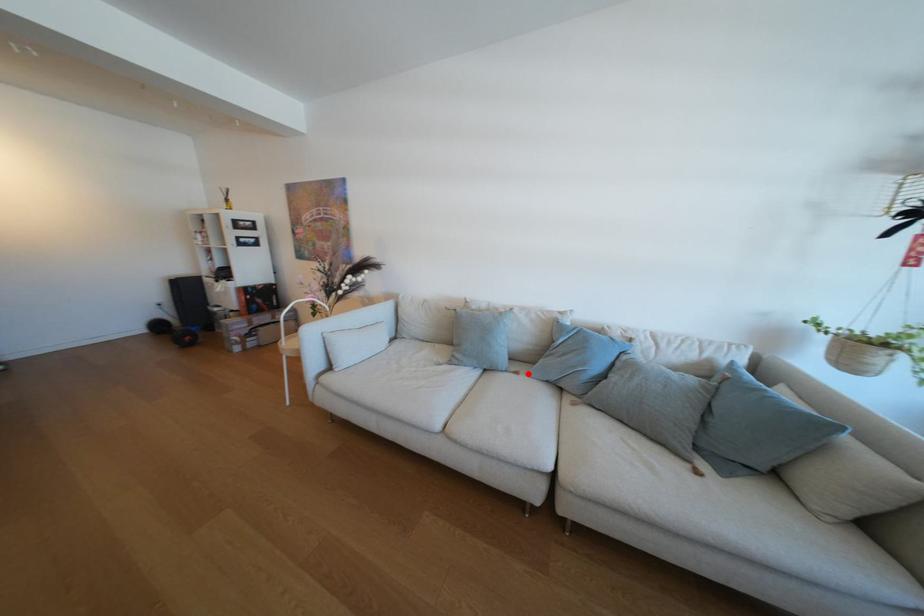
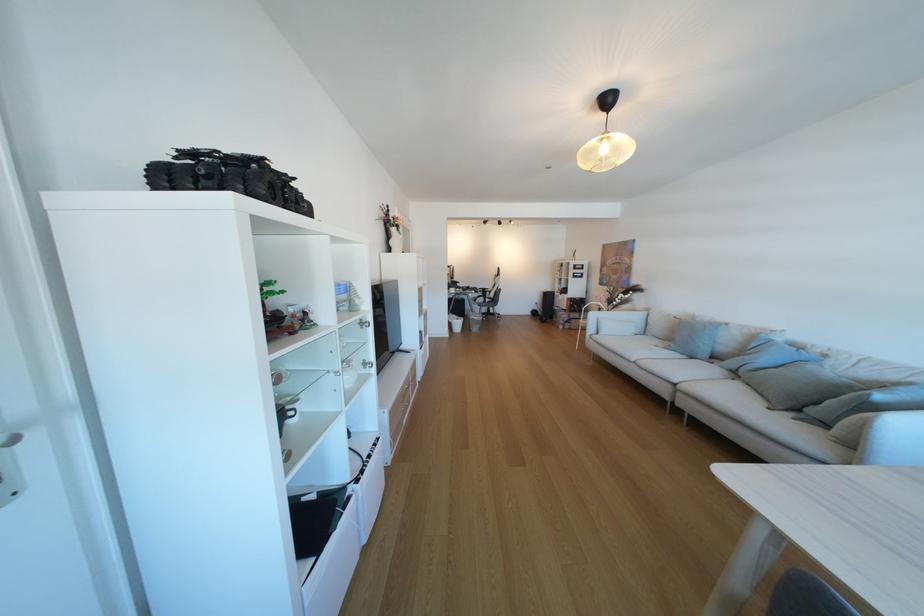
Question: I am providing you with two images of the same scene from different viewpoints. Given a red point in image1, look at the same physical point in image2. Is it:

Choices:
 (A) Closer to the viewpoint
 (B) Farther from the viewpoint

Answer: (A)